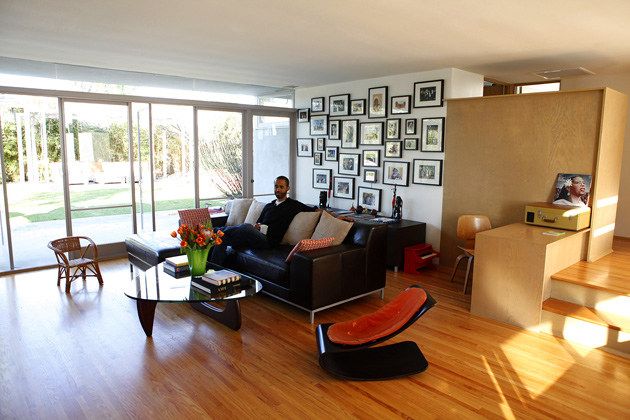
I want to click on books, so click(x=175, y=271), click(x=178, y=262), click(x=209, y=290), click(x=219, y=281).